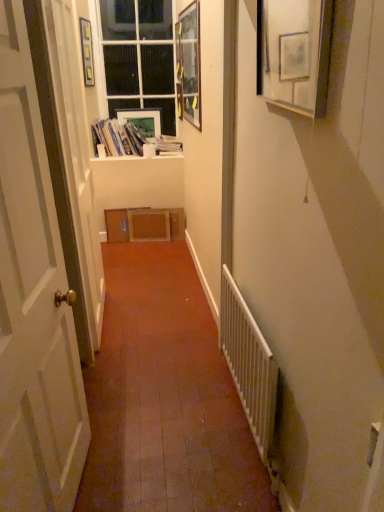
Question: Visually, is matte black picture frame at upper left, which appears as the fourth picture frame when viewed from the right, positioned to the left or to the right of matte plastic picture frame at upper center, the third picture frame when ordered from right to left?

Choices:
 (A) left
 (B) right

Answer: (A)

Question: From a real-world perspective, is matte black picture frame at upper left, which is counted as the 2th picture frame, starting from the back, positioned above or below matte plastic picture frame at upper center, acting as the 2th picture frame starting from the left?

Choices:
 (A) above
 (B) below

Answer: (A)

Question: Which object is positioned farthest from the wooden picture frame at upper center, which appears as the 3th picture frame when viewed from the back?

Choices:
 (A) white paper stack at upper center
 (B) white glossy door at left
 (C) white metal radiator at lower right
 (D) matte black picture frame at upper left, which appears as the fourth picture frame when viewed from the right
 (E) white glass window at upper center

Answer: (B)

Question: Considering the real-world distances, which object is farthest from the white metal radiator at lower right?

Choices:
 (A) white wood window sill at upper center
 (B) white paper stack at upper center
 (C) wooden picture frame at upper right, the 4th picture frame when ordered from back to front
 (D) white glass window at upper center
 (E) wooden picture frame at upper center, positioned as the 3th picture frame in left-to-right order

Answer: (D)